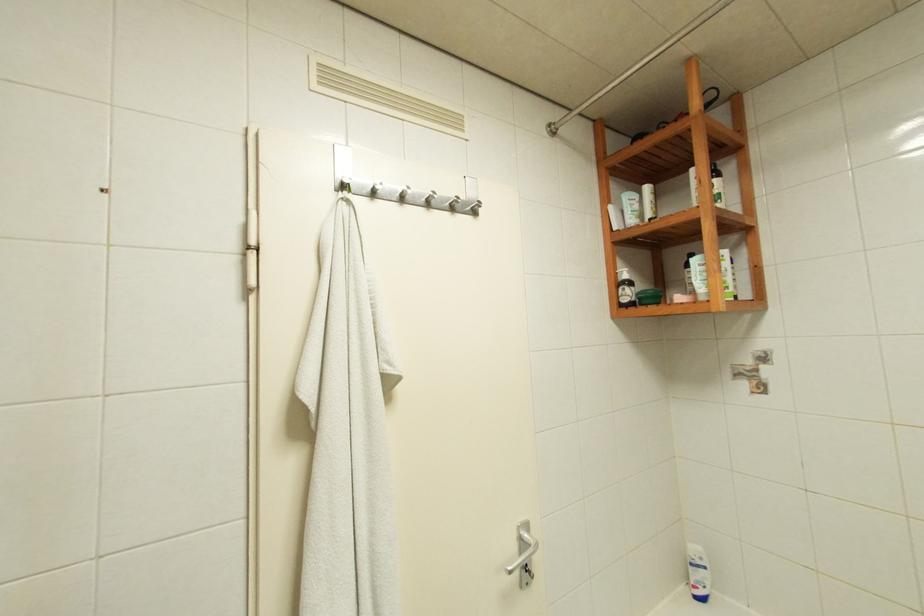
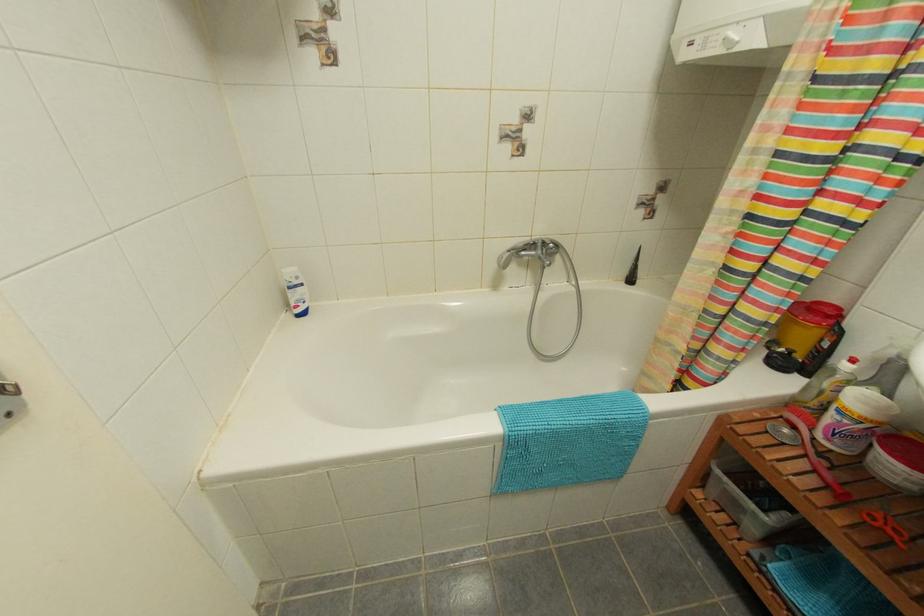
The images are taken continuously from a first-person perspective. In which direction is your viewpoint rotating?

The camera's rotation is toward right-down.